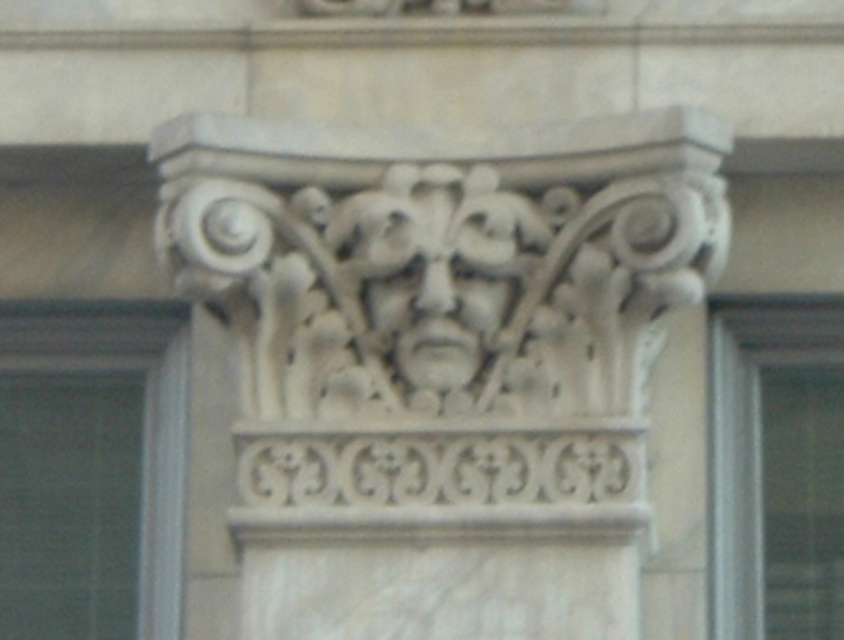
You are an architect examining a detailed stone carving. You notice a specific point at coordinates point (442,358). Based on the scene description, can you determine what part of the carving this point corresponds to?

The point (442,358) is located on the white stone carving at center, which is the central figure of a stylized face or mask flanked by stylized foliage or vines.

You are an art conservator examining the architectural detail. You notice the white stone carving at center and the white stone face at center. Which one appears closer to you based on their spatial arrangement?

The white stone carving at center is in front of the white stone face at center, so it appears closer to you.

You are an architect examining the building facade. You notice two white stone elements at the center of the image. One is labeled as the white stone carving at center and the other as the white stone face at center. Which of these two elements is taller?

The white stone carving at center is much taller than the white stone face at center.